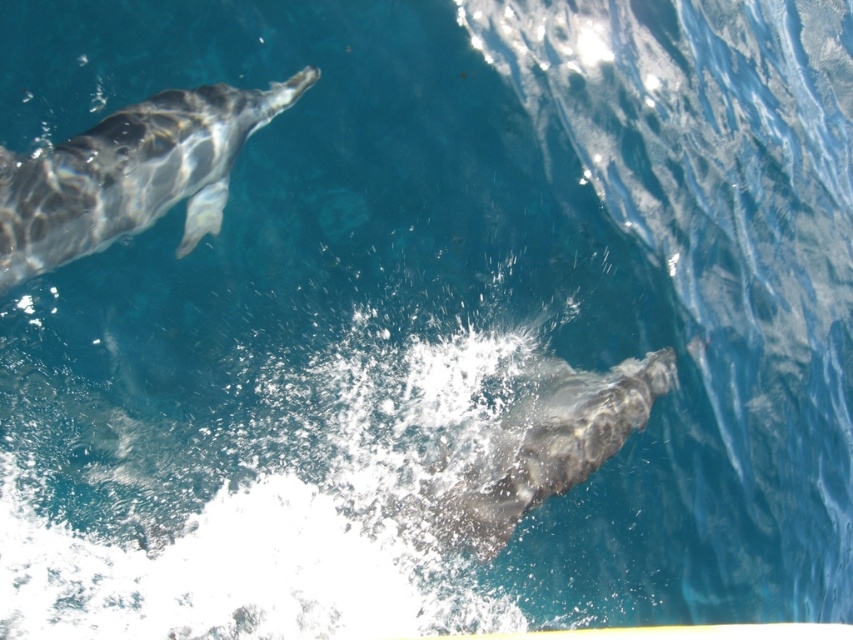
Question: Which object is farther from the camera taking this photo?

Choices:
 (A) gray textured dolphin at lower right
 (B) gray shiny dolphin at upper left

Answer: (A)

Question: Where is gray shiny dolphin at upper left located in relation to gray textured dolphin at lower right in the image?

Choices:
 (A) right
 (B) left

Answer: (B)

Question: Is gray shiny dolphin at upper left further to the viewer compared to gray textured dolphin at lower right?

Choices:
 (A) yes
 (B) no

Answer: (B)

Question: Which point is closer to the camera?

Choices:
 (A) gray textured dolphin at lower right
 (B) gray shiny dolphin at upper left

Answer: (B)

Question: Can you confirm if gray shiny dolphin at upper left is bigger than gray textured dolphin at lower right?

Choices:
 (A) no
 (B) yes

Answer: (B)